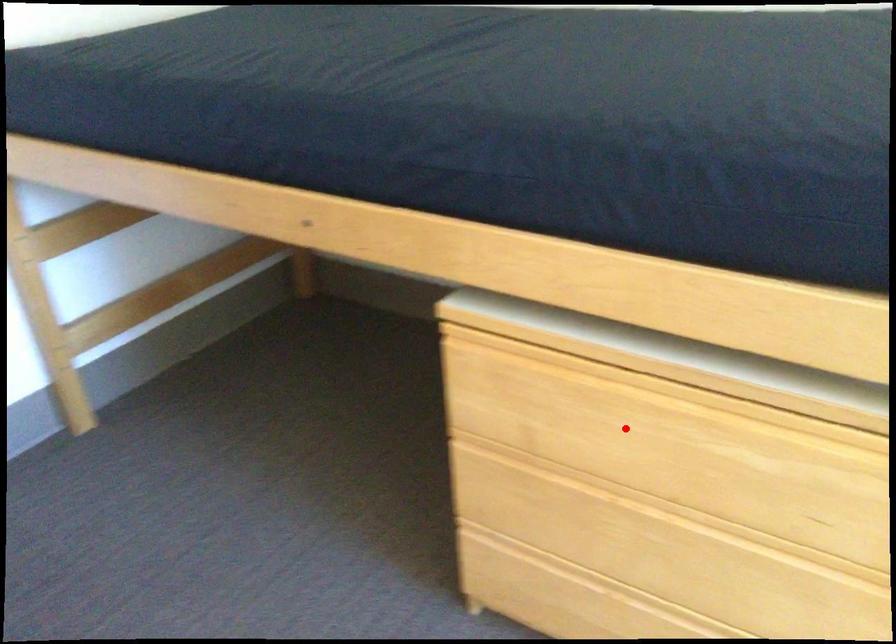
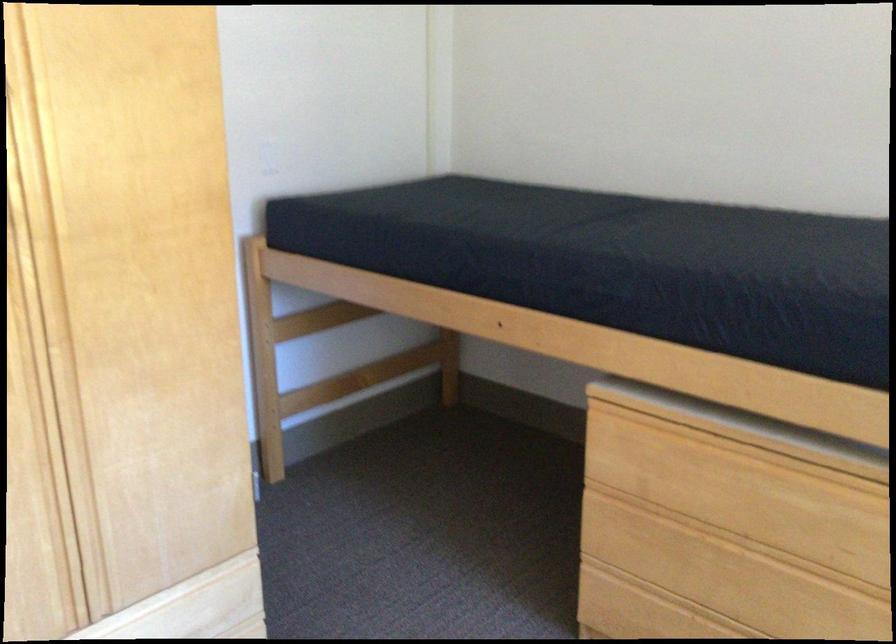
Question: I am providing you with two images of the same scene from different viewpoints. In image1, a red point is highlighted. Considering the same 3D point in image2, which of the following is correct?

Choices:
 (A) It is closer
 (B) It is farther

Answer: (B)